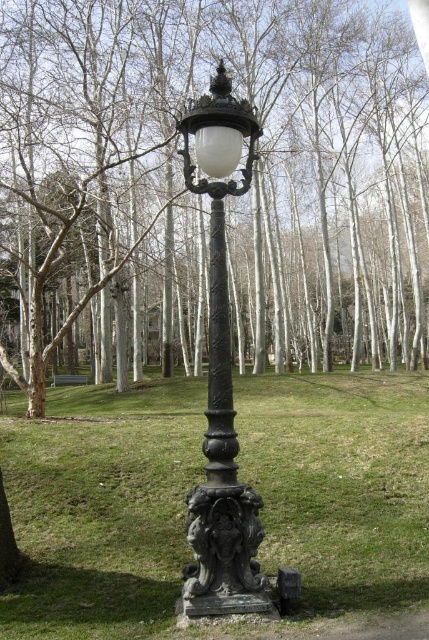
You are standing in the park and want to take a photo of the brown wood tree at center. If your camera has a maximum focus range of 5 meters, will it be able to capture the tree clearly?

The brown wood tree at center is 4.79 meters away from the camera, which is within the 5 meters maximum focus range. Therefore, the camera can capture the tree clearly.

You are standing at the entrance of the park and want to locate the brown wood tree at center. Based on the coordinates provided, can you determine its exact position in the image?

The brown wood tree at center is located at coordinates point (211, 180).